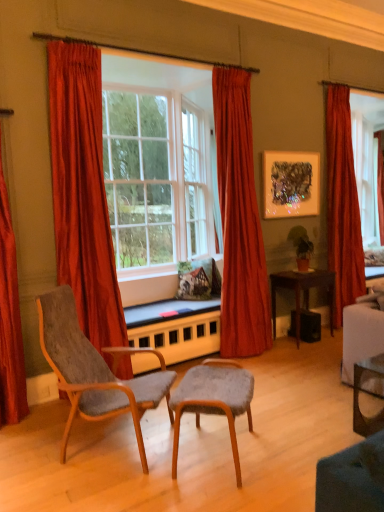
Where is `vacant space in front of velvet red curtain at center, placed as the second curtain when sorted from right to left`? The height and width of the screenshot is (512, 384). vacant space in front of velvet red curtain at center, placed as the second curtain when sorted from right to left is located at coordinates (265, 368).